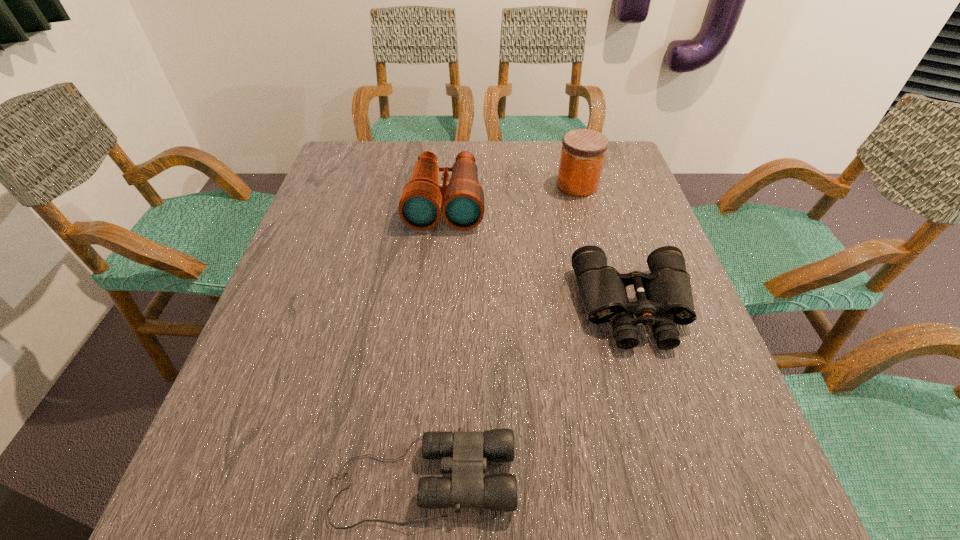
This screenshot has height=540, width=960. I want to click on the tallest object, so click(x=583, y=152).

The height and width of the screenshot is (540, 960). In order to click on the third shortest object in this screenshot , I will do `click(462, 204)`.

Locate an element on the screen. the tallest binoculars is located at coordinates (462, 204).

Identify the location of the rightmost binoculars. This screenshot has height=540, width=960. (664, 297).

Identify the location of the second tallest binoculars. This screenshot has height=540, width=960. (664, 297).

Where is `the shortest binoculars`? Image resolution: width=960 pixels, height=540 pixels. the shortest binoculars is located at coordinates pyautogui.click(x=464, y=453).

At what (x,y) coordinates should I click in order to perform the action: click on the nearest object. Please return your answer as a coordinate pair (x, y). Looking at the image, I should click on (464, 453).

This screenshot has height=540, width=960. In order to click on vacant region located on the left of the tallest object in this screenshot , I will do `click(453, 185)`.

You are a GUI agent. You are given a task and a screenshot of the screen. Output one action in this format:
    pyautogui.click(x=<x>, y=<y>)
    Task: Click on the vacant region located through the lenses of the tallest binoculars
    
    Given the screenshot: What is the action you would take?
    pyautogui.click(x=431, y=356)

The height and width of the screenshot is (540, 960). What are the coordinates of `vacant space located through the eyepieces of the second nearest object` in the screenshot? It's located at (658, 384).